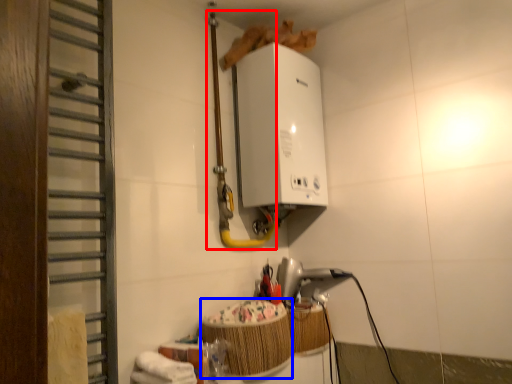
Question: Which object is further to the camera taking this photo, pipe (highlighted by a red box) or basket (highlighted by a blue box)?

Choices:
 (A) pipe
 (B) basket

Answer: (A)